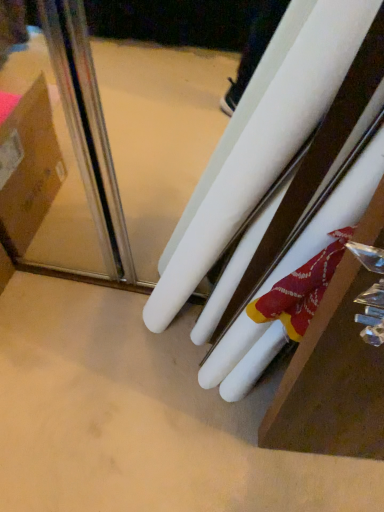
Identify the location of matte white surface at center. This screenshot has width=384, height=512. tap(140, 417).

What is the approximate height of matte white surface at center?

1.75 inches.

Describe the element at coordinates (140, 417) in the screenshot. The height and width of the screenshot is (512, 384). I see `matte white surface at center` at that location.

At what (x,y) coordinates should I click in order to perform the action: click on matte white surface at center. Please return your answer as a coordinate pair (x, y). The image size is (384, 512). Looking at the image, I should click on (140, 417).